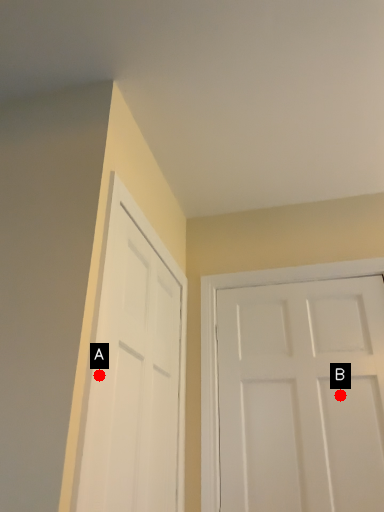
Question: Two points are circled on the image, labeled by A and B beside each circle. Which point is closer to the camera?

Choices:
 (A) A is closer
 (B) B is closer

Answer: (A)